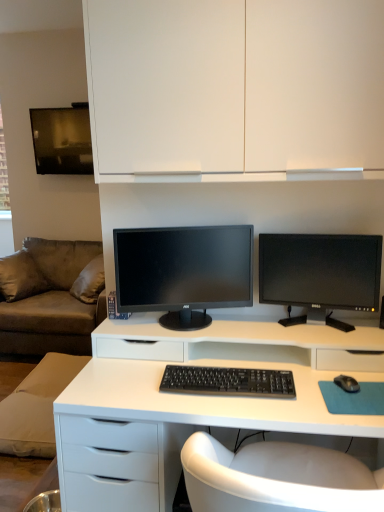
The width and height of the screenshot is (384, 512). What are the coordinates of `brown fabric couch at left` in the screenshot? It's located at (51, 297).

You are a GUI agent. You are given a task and a screenshot of the screen. Output one action in this format:
    pyautogui.click(x=<x>, y=<y>)
    Task: Click on the black glossy monitor at center right, which appears as the second computer monitor when viewed from the left
    
    Given the screenshot: What is the action you would take?
    pyautogui.click(x=320, y=274)

Are brown fabric couch at left and black glossy monitor at center right, which appears as the second computer monitor when viewed from the left, located far from each other?

brown fabric couch at left is far away from black glossy monitor at center right, which appears as the second computer monitor when viewed from the left.

The image size is (384, 512). What are the coordinates of `studio couch that is on the left side of black glossy monitor at center right, which appears as the second computer monitor when viewed from the left` in the screenshot? It's located at (51, 297).

Can you confirm if brown fabric couch at left is wider than black glossy monitor at center right, which appears as the second computer monitor when viewed from the left?

Indeed, brown fabric couch at left has a greater width compared to black glossy monitor at center right, which appears as the second computer monitor when viewed from the left.

Can you confirm if brown fabric couch at left is bigger than black glossy monitor at center right, placed as the first computer monitor when sorted from right to left?

Correct, brown fabric couch at left is larger in size than black glossy monitor at center right, placed as the first computer monitor when sorted from right to left.

Does black plastic keyboard at center have a greater width compared to brown fabric couch at left?

No.

Considering the sizes of black plastic keyboard at center and brown fabric couch at left in the image, is black plastic keyboard at center bigger or smaller than brown fabric couch at left?

black plastic keyboard at center is smaller than brown fabric couch at left.

Can you tell me how much black plastic keyboard at center and brown fabric couch at left differ in facing direction?

2.56 degrees.

Is black plastic keyboard at center facing away from brown fabric couch at left?

black plastic keyboard at center does not have its back to brown fabric couch at left.

From a real-world perspective, is black glossy monitor at center right, placed as the first computer monitor when sorted from right to left, positioned over white matte desk at center based on gravity?

Yes, from a real-world perspective, black glossy monitor at center right, placed as the first computer monitor when sorted from right to left, is over white matte desk at center

Visually, is black glossy monitor at center right, which appears as the second computer monitor when viewed from the left, positioned to the left or to the right of white matte desk at center?

black glossy monitor at center right, which appears as the second computer monitor when viewed from the left, is to the right of white matte desk at center.

Does black glossy monitor at center right, placed as the first computer monitor when sorted from right to left, turn towards white matte desk at center?

No, black glossy monitor at center right, placed as the first computer monitor when sorted from right to left, is not turned towards white matte desk at center.

Can you confirm if black glossy monitor at center right, placed as the first computer monitor when sorted from right to left, is taller than white matte desk at center?

In fact, black glossy monitor at center right, placed as the first computer monitor when sorted from right to left, may be shorter than white matte desk at center.

From a real-world perspective, is black glossy monitor at center right, which appears as the second computer monitor when viewed from the left, positioned under matte black monitor at center, which appears as the second computer monitor when viewed from the right, based on gravity?

Yes, from a real-world perspective, black glossy monitor at center right, which appears as the second computer monitor when viewed from the left, is beneath matte black monitor at center, which appears as the second computer monitor when viewed from the right.

From the picture: Does black glossy monitor at center right, placed as the first computer monitor when sorted from right to left, have a larger size compared to matte black monitor at center, which appears as the second computer monitor when viewed from the right?

Actually, black glossy monitor at center right, placed as the first computer monitor when sorted from right to left, might be smaller than matte black monitor at center, which appears as the second computer monitor when viewed from the right.

What's the angular difference between black glossy monitor at center right, which appears as the second computer monitor when viewed from the left, and matte black monitor at center, arranged as the 1th computer monitor when viewed from the left,'s facing directions?

There is a 26.3-degree angle between the facing directions of black glossy monitor at center right, which appears as the second computer monitor when viewed from the left, and matte black monitor at center, arranged as the 1th computer monitor when viewed from the left.

You are a GUI agent. You are given a task and a screenshot of the screen. Output one action in this format:
    pyautogui.click(x=<x>, y=<y>)
    Task: Click on the computer monitor in front of the matte black monitor at center, arranged as the 1th computer monitor when viewed from the left
    
    Given the screenshot: What is the action you would take?
    pyautogui.click(x=320, y=274)

Is black matte mouse at lower right oriented towards black glossy monitor at center right, which appears as the second computer monitor when viewed from the left?

No, black matte mouse at lower right does not turn towards black glossy monitor at center right, which appears as the second computer monitor when viewed from the left.

Does black matte mouse at lower right come behind black glossy monitor at center right, which appears as the second computer monitor when viewed from the left?

No, black matte mouse at lower right is closer to the camera.

Considering the sizes of objects matte black monitor at center, which appears as the second computer monitor when viewed from the right, and brown fabric couch at left in the image provided, who is thinner, matte black monitor at center, which appears as the second computer monitor when viewed from the right, or brown fabric couch at left?

With smaller width is matte black monitor at center, which appears as the second computer monitor when viewed from the right.

Considering the positions of objects matte black monitor at center, arranged as the 1th computer monitor when viewed from the left, and brown fabric couch at left in the image provided, who is in front, matte black monitor at center, arranged as the 1th computer monitor when viewed from the left, or brown fabric couch at left?

matte black monitor at center, arranged as the 1th computer monitor when viewed from the left, is more forward.

Could you tell me if matte black monitor at center, which appears as the second computer monitor when viewed from the right, is turned towards brown fabric couch at left?

No, matte black monitor at center, which appears as the second computer monitor when viewed from the right, does not turn towards brown fabric couch at left.

Is black glossy monitor at center right, placed as the first computer monitor when sorted from right to left, aimed at black plastic keyboard at center?

Yes, black glossy monitor at center right, placed as the first computer monitor when sorted from right to left, is aimed at black plastic keyboard at center.

Based on the photo, from a real-world perspective, is black glossy monitor at center right, placed as the first computer monitor when sorted from right to left, on top of black plastic keyboard at center?

Yes, from a real-world perspective, black glossy monitor at center right, placed as the first computer monitor when sorted from right to left, is above black plastic keyboard at center.

Does black glossy monitor at center right, which appears as the second computer monitor when viewed from the left, have a lesser width compared to black plastic keyboard at center?

Yes.

Looking at this image, can you see black glossy monitor at center right, which appears as the second computer monitor when viewed from the left, touching black plastic keyboard at center?

black glossy monitor at center right, which appears as the second computer monitor when viewed from the left, is not next to black plastic keyboard at center, and they're not touching.

Image resolution: width=384 pixels, height=512 pixels. There is a brown fabric couch at left. Identify the location of the 1st computer monitor above it (from the image's perspective). (320, 274).

Locate an element on the screen. This screenshot has width=384, height=512. computer keyboard in front of the brown fabric couch at left is located at coordinates click(x=228, y=381).

Which object lies further to the anchor point black glossy monitor at center right, placed as the first computer monitor when sorted from right to left, white matte desk at center or black plastic keyboard at center?

black plastic keyboard at center.

Looking at the image, which one is located further to black plastic keyboard at center, matte black monitor at center, which appears as the second computer monitor when viewed from the right, or teal fabric mousepad at lower right?

matte black monitor at center, which appears as the second computer monitor when viewed from the right.

From the image, which object appears to be nearer to black glossy monitor at center right, which appears as the second computer monitor when viewed from the left, white matte desk at center or white matte cabinet at upper center?

white matte desk at center.

Considering their positions, is black glossy monitor at center right, which appears as the second computer monitor when viewed from the left, positioned closer to matte black monitor at center, arranged as the 1th computer monitor when viewed from the left, than teal fabric mousepad at lower right?

black glossy monitor at center right, which appears as the second computer monitor when viewed from the left, is positioned closer to the anchor matte black monitor at center, arranged as the 1th computer monitor when viewed from the left.

In the scene shown: When comparing their distances from matte black monitor at center, which appears as the second computer monitor when viewed from the right, does brown fabric couch at left or black plastic keyboard at center seem further?

brown fabric couch at left lies further to matte black monitor at center, which appears as the second computer monitor when viewed from the right, than the other object.

Based on their spatial positions, is white matte desk at center or white matte cabinet at upper center further from matte black monitor at center, arranged as the 1th computer monitor when viewed from the left?

Based on the image, white matte cabinet at upper center appears to be further to matte black monitor at center, arranged as the 1th computer monitor when viewed from the left.

Which object lies further to the anchor point white matte desk at center, black glossy monitor at center right, which appears as the second computer monitor when viewed from the left, or black plastic keyboard at center?

black glossy monitor at center right, which appears as the second computer monitor when viewed from the left, is further to white matte desk at center.

Which object lies further to the anchor point brown fabric couch at left, black plastic keyboard at center or white matte cabinet at upper center?

The object further to brown fabric couch at left is white matte cabinet at upper center.

The image size is (384, 512). What are the coordinates of `mousepad between matte black monitor at center, which appears as the second computer monitor when viewed from the right, and white matte desk at center, in the vertical direction` in the screenshot? It's located at (354, 398).

This screenshot has height=512, width=384. Identify the location of computer monitor between matte black monitor at center, arranged as the 1th computer monitor when viewed from the left, and teal fabric mousepad at lower right, in the horizontal direction. (320, 274).

You are a GUI agent. You are given a task and a screenshot of the screen. Output one action in this format:
    pyautogui.click(x=<x>, y=<y>)
    Task: Click on the mouse between white matte desk at center and brown fabric couch at left in the front-back direction
    
    Given the screenshot: What is the action you would take?
    pyautogui.click(x=347, y=383)

Identify the location of computer keyboard between matte black monitor at center, which appears as the second computer monitor when viewed from the right, and white matte desk at center in the up-down direction. This screenshot has height=512, width=384. (228, 381).